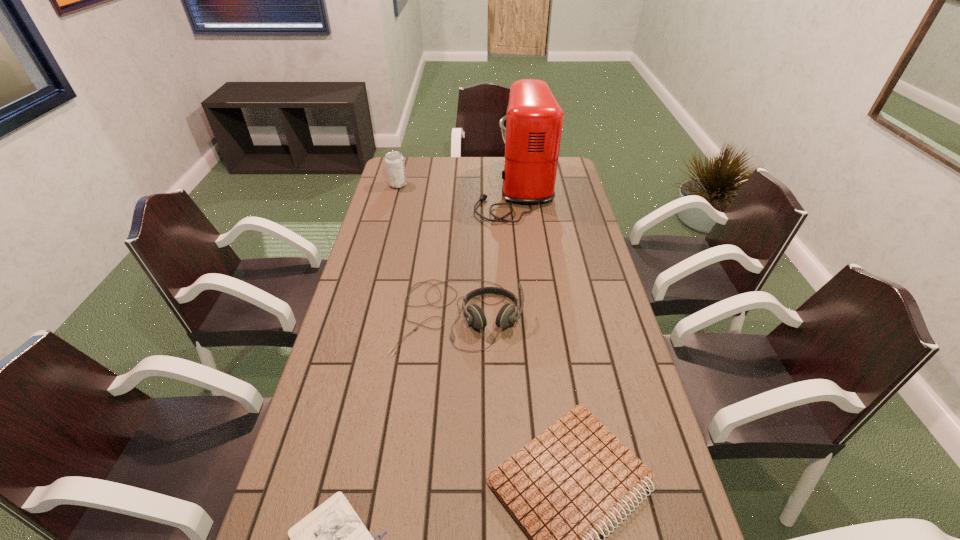
Find the location of `soda can located in the far edge section of the desktop`. soda can located in the far edge section of the desktop is located at coordinates (395, 168).

I want to click on object at the left edge, so click(x=395, y=168).

Locate an element on the screen. object located in the right edge section of the desktop is located at coordinates (531, 130).

Where is `object situated at the far left corner`? The height and width of the screenshot is (540, 960). object situated at the far left corner is located at coordinates (395, 168).

Locate an element on the screen. The width and height of the screenshot is (960, 540). object situated at the far right corner is located at coordinates (531, 130).

This screenshot has height=540, width=960. Find the location of `free space at the far edge of the desktop`. free space at the far edge of the desktop is located at coordinates (497, 157).

Where is `free space at the left edge of the desktop`? The image size is (960, 540). free space at the left edge of the desktop is located at coordinates (385, 190).

You are a GUI agent. You are given a task and a screenshot of the screen. Output one action in this format:
    pyautogui.click(x=<x>, y=<y>)
    Task: Click on the free point at the right edge
    Image resolution: width=960 pixels, height=540 pixels.
    Given the screenshot: What is the action you would take?
    pyautogui.click(x=656, y=505)

In the image, there is a desktop. Where is `blank space at the far right corner`? blank space at the far right corner is located at coordinates (566, 171).

The image size is (960, 540). Find the location of `free spot between the third nearest object and the kitchen mixer`. free spot between the third nearest object and the kitchen mixer is located at coordinates (487, 252).